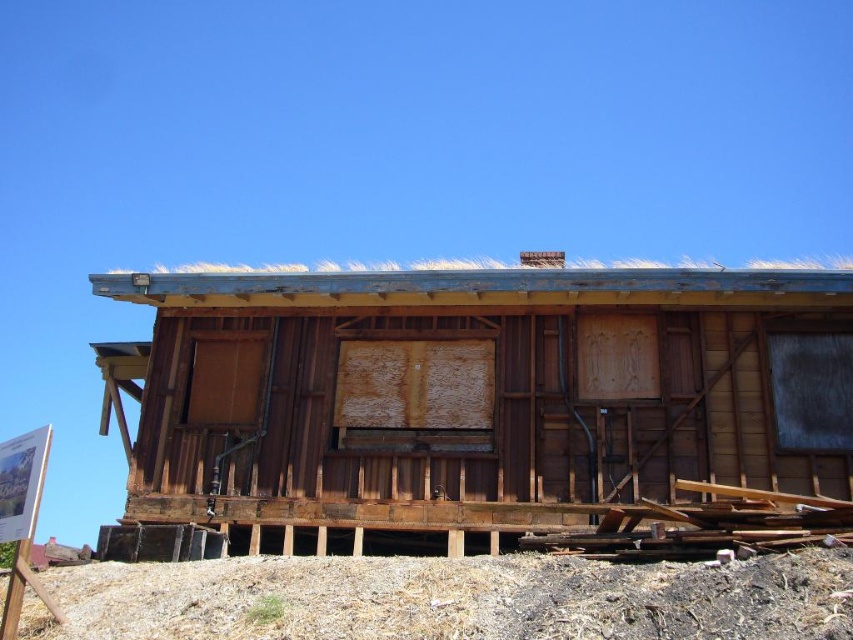
Question: From the image, what is the correct spatial relationship of wooden at center in relation to brown dirt at lower center?

Choices:
 (A) right
 (B) left

Answer: (A)

Question: Which point is closer to the camera taking this photo?

Choices:
 (A) (252, 634)
 (B) (718, 397)

Answer: (A)

Question: Which point is closer to the camera?

Choices:
 (A) (120, 605)
 (B) (166, 380)

Answer: (A)

Question: Is the position of wooden at center less distant than that of brown dirt at lower center?

Choices:
 (A) no
 (B) yes

Answer: (A)

Question: Is wooden at center smaller than brown dirt at lower center?

Choices:
 (A) no
 (B) yes

Answer: (B)

Question: Which point is farther to the camera?

Choices:
 (A) brown dirt at lower center
 (B) wooden at center

Answer: (B)